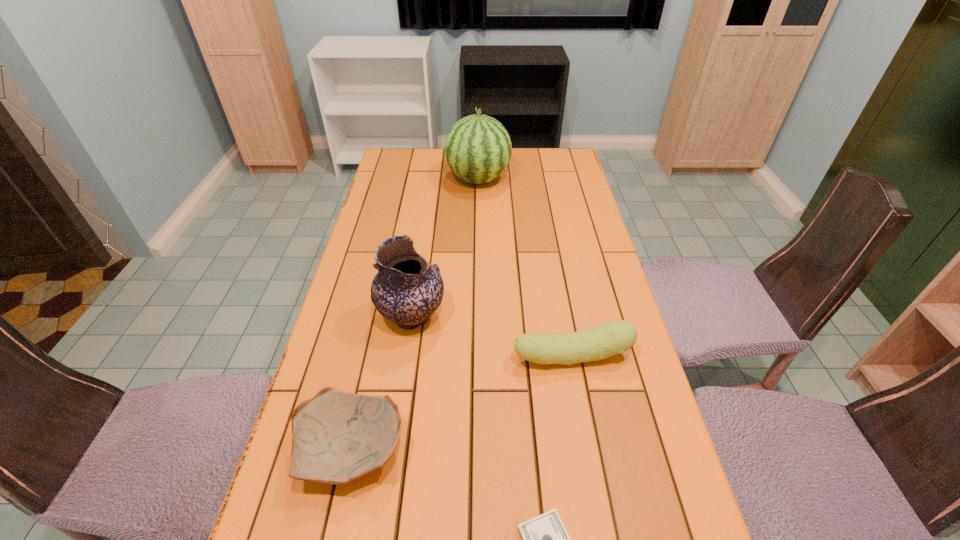
This screenshot has width=960, height=540. I want to click on vacant region located on the right of the nearer pottery, so click(445, 449).

The image size is (960, 540). What are the coordinates of `object present at the far edge` in the screenshot? It's located at (478, 148).

Locate an element on the screen. This screenshot has height=540, width=960. object that is at the right edge is located at coordinates (617, 336).

At what (x,y) coordinates should I click in order to perform the action: click on free location at the far edge. Please return your answer as a coordinate pair (x, y). Image resolution: width=960 pixels, height=540 pixels. Looking at the image, I should click on (426, 163).

This screenshot has width=960, height=540. What are the coordinates of `free region at the left edge of the desktop` in the screenshot? It's located at (378, 192).

At what (x,y) coordinates should I click in order to perform the action: click on vacant space at the right edge of the desktop. Please return your answer as a coordinate pair (x, y). The image size is (960, 540). Looking at the image, I should click on (570, 241).

In the image, there is a desktop. Where is `free region at the far left corner`? This screenshot has height=540, width=960. free region at the far left corner is located at coordinates (391, 172).

You are a GUI agent. You are given a task and a screenshot of the screen. Output one action in this format:
    pyautogui.click(x=<x>, y=<y>)
    Task: Click on the blank region between the shorter pottery and the second tallest object
    
    Given the screenshot: What is the action you would take?
    pyautogui.click(x=382, y=383)

Image resolution: width=960 pixels, height=540 pixels. Find the location of `free area in between the taller pottery and the shorter pottery`. free area in between the taller pottery and the shorter pottery is located at coordinates (382, 383).

At what (x,y) coordinates should I click in order to perform the action: click on free space between the fourth tallest object and the farther pottery. Please return your answer as a coordinate pair (x, y). The height and width of the screenshot is (540, 960). Looking at the image, I should click on (382, 383).